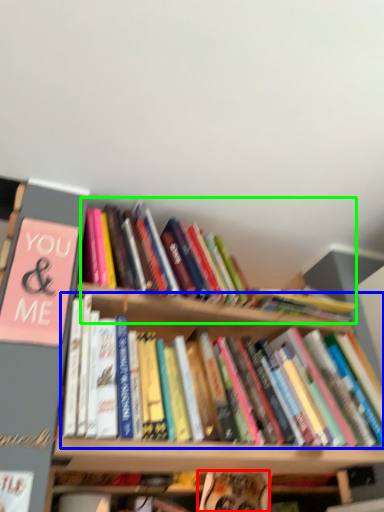
Question: Estimate the real-world distances between objects in this image. Which object is closer to book (highlighted by a red box), book (highlighted by a blue box) or book (highlighted by a green box)?

Choices:
 (A) book
 (B) book

Answer: (A)